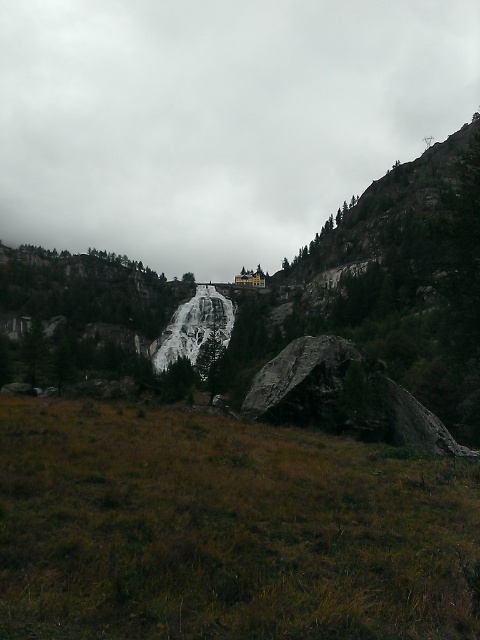
You are standing at the edge of the cliff overlooking the waterfall and notice the brown dry grass at lower center. Based on its position, can you determine if it is closer to the cliff edge or the base of the waterfall?

The brown dry grass at lower center is located at point (225, 529), which places it closer to the base of the waterfall than the cliff edge.

You are standing at the base of the waterfall in the image and want to reach the top of the cliff. You notice two points marked on the cliff face. Which of the two points, point (120, 74) or point (24, 604), is closer to you?

Point (24, 604) is closer to you because it is less further to the camera than point (120, 74).

You are standing at the base of the waterfall and want to look up at the cloudy gray sky at upper center and the dark gray rock at center. Which one will appear closer to your eyes?

The cloudy gray sky at upper center appears closer to your eyes because it is further to the viewer than the dark gray rock at center, meaning it is positioned in front of the rock from your perspective.